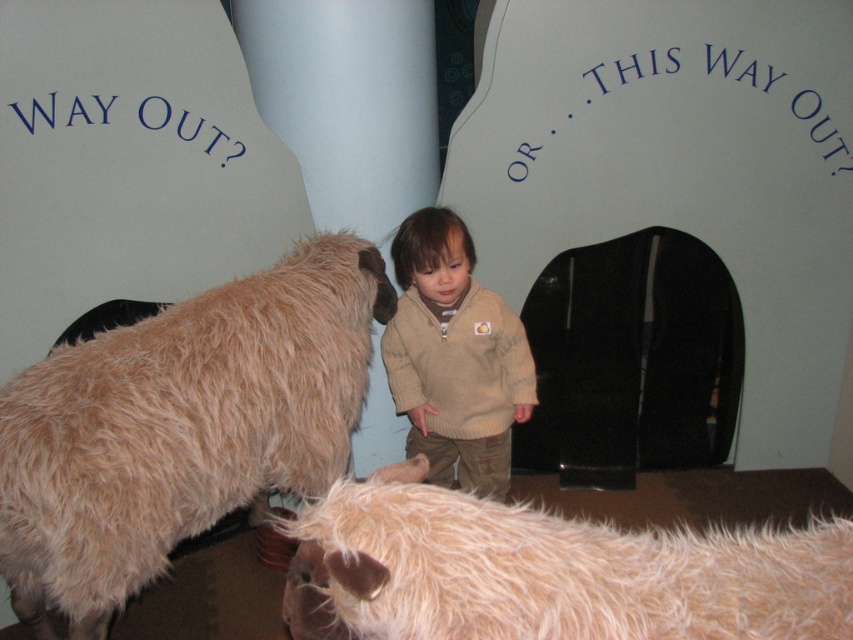
Between fuzzy woolen sheep at lower left and fluffy beige goat at lower center, which one has more height?

fuzzy woolen sheep at lower left

Is fuzzy woolen sheep at lower left wider than fluffy beige goat at lower center?

Yes, fuzzy woolen sheep at lower left is wider than fluffy beige goat at lower center.

What do you see at coordinates (180, 426) in the screenshot?
I see `fuzzy woolen sheep at lower left` at bounding box center [180, 426].

Image resolution: width=853 pixels, height=640 pixels. Find the location of `fuzzy woolen sheep at lower left`. fuzzy woolen sheep at lower left is located at coordinates (180, 426).

Which is behind, point (323, 401) or point (401, 262)?

The point (401, 262) is more distant.

Is fuzzy woolen sheep at lower left taller than beige knitted sweater at center?

Yes, fuzzy woolen sheep at lower left is taller than beige knitted sweater at center.

Based on the photo, measure the distance between point (263,412) and camera.

Point (263,412) is 7.38 feet from camera.

Where is `fuzzy woolen sheep at lower left`? This screenshot has height=640, width=853. fuzzy woolen sheep at lower left is located at coordinates (180, 426).

Is fluffy beige goat at lower center further to the viewer compared to beige knitted sweater at center?

No.

Is fluffy beige goat at lower center positioned before beige knitted sweater at center?

Yes.

Does point (538, 573) come behind point (434, 458)?

No, (538, 573) is closer to viewer.

Find the location of `fluffy beige goat at lower center`. fluffy beige goat at lower center is located at coordinates (548, 572).